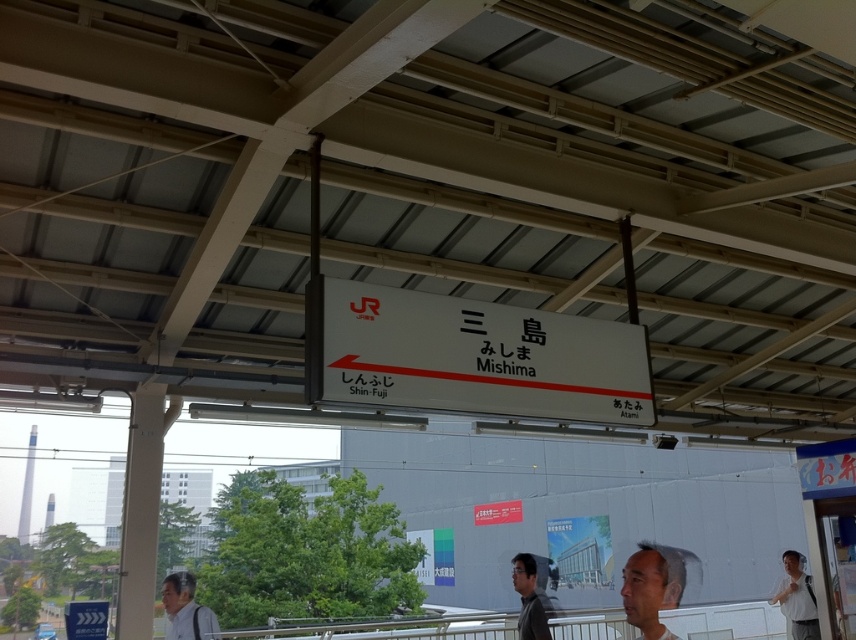
You are a photographer standing on the Mishima station platform. You want to take a photo of the smooth skin face at lower center and the light gray shirt at lower left. Which object is positioned closer to your camera lens?

The smooth skin face at lower center is closer to the viewer than the light gray shirt at lower left, so the smooth skin face at lower center will be closer to your camera lens.

You are a photographer standing on the Mishima station platform. You see a person with a smooth skin face at lower center and a light gray shirt at lower left. Which object is positioned to the right side from your viewpoint?

The smooth skin face at lower center is positioned to the right of the light gray shirt at lower left.